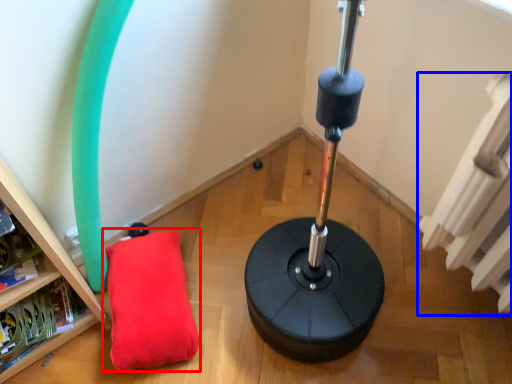
Question: Which point is further to the camera, pillow (highlighted by a red box) or radiator (highlighted by a blue box)?

Choices:
 (A) pillow
 (B) radiator

Answer: (A)